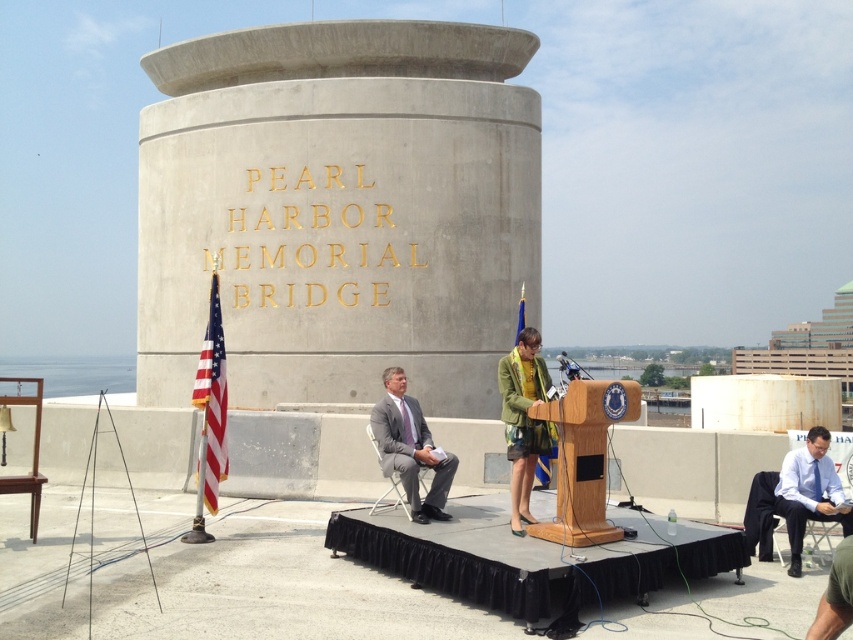
Can you confirm if green fabric jacket at center is bigger than gray matte suit at center?

Actually, green fabric jacket at center might be smaller than gray matte suit at center.

Who is taller, green fabric jacket at center or gray matte suit at center?

With more height is green fabric jacket at center.

Describe the element at coordinates (523, 419) in the screenshot. The image size is (853, 640). I see `green fabric jacket at center` at that location.

The image size is (853, 640). Find the location of `green fabric jacket at center`. green fabric jacket at center is located at coordinates (523, 419).

The image size is (853, 640). What do you see at coordinates (339, 209) in the screenshot? I see `concrete gold lettering at center` at bounding box center [339, 209].

Is point (206, 186) in front of point (537, 365)?

No, it is behind (537, 365).

Image resolution: width=853 pixels, height=640 pixels. In order to click on concrete gold lettering at center in this screenshot , I will do `click(339, 209)`.

Which is in front, point (546, 524) or point (552, 429)?

Point (546, 524) is in front.

Identify the location of wooden podium at center. (584, 458).

You are a GUI agent. You are given a task and a screenshot of the screen. Output one action in this format:
    pyautogui.click(x=<x>, y=<y>)
    Task: Click on the wooden podium at center
    
    Given the screenshot: What is the action you would take?
    pyautogui.click(x=584, y=458)